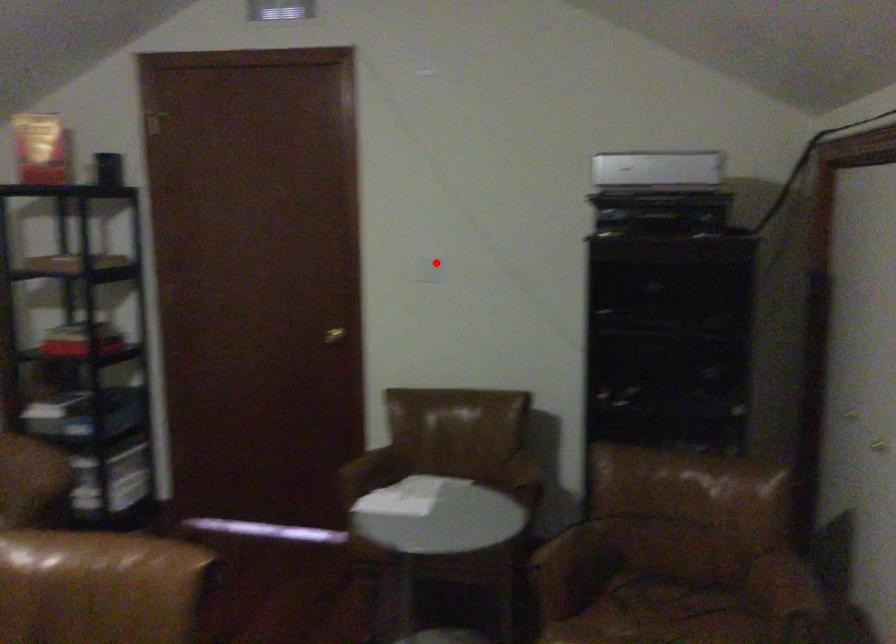
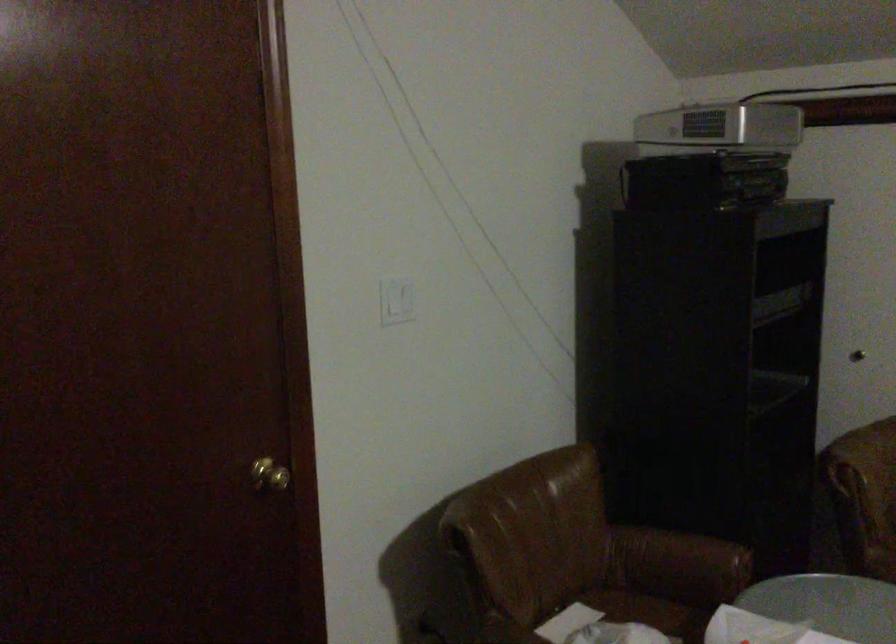
Question: I am providing you with two images of the same scene from different viewpoints. Given a red point in image1, look at the same physical point in image2. Is it:

Choices:
 (A) Closer to the viewpoint
 (B) Farther from the viewpoint

Answer: (A)